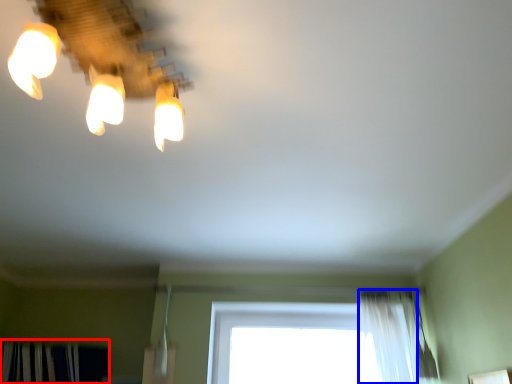
Question: Which object appears closest to the camera in this image, curtain (highlighted by a red box) or shower curtain (highlighted by a blue box)?

Choices:
 (A) curtain
 (B) shower curtain

Answer: (B)